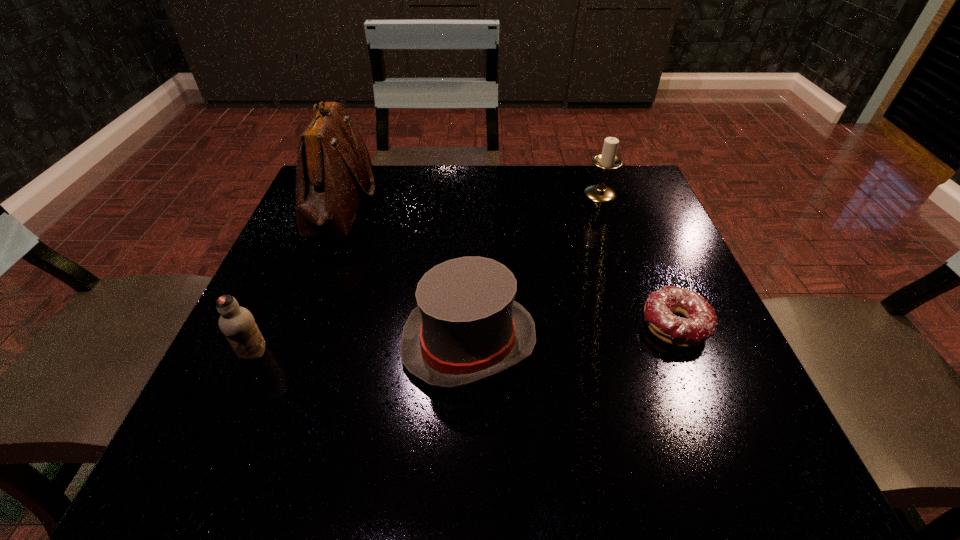
Locate an element on the screen. This screenshot has width=960, height=540. shoulder bag situated at the far edge is located at coordinates 334,168.

Image resolution: width=960 pixels, height=540 pixels. In order to click on candle holder present at the far edge in this screenshot , I will do `click(607, 160)`.

The height and width of the screenshot is (540, 960). In order to click on shoulder bag that is at the left edge in this screenshot , I will do `click(334, 168)`.

Where is `chocolate milk at the left edge`? chocolate milk at the left edge is located at coordinates (237, 323).

Identify the location of candle holder that is positioned at the right edge. (607, 160).

The width and height of the screenshot is (960, 540). In order to click on doughnut located in the right edge section of the desktop in this screenshot , I will do `click(700, 323)`.

Where is `object that is at the far left corner`? The height and width of the screenshot is (540, 960). object that is at the far left corner is located at coordinates (334, 168).

Find the location of a particular element. The height and width of the screenshot is (540, 960). object that is at the far right corner is located at coordinates (607, 160).

In the image, there is a desktop. Identify the location of blank space at the far edge. The image size is (960, 540). (573, 167).

Image resolution: width=960 pixels, height=540 pixels. In the image, there is a desktop. Find the location of `vacant space at the near edge`. vacant space at the near edge is located at coordinates (366, 470).